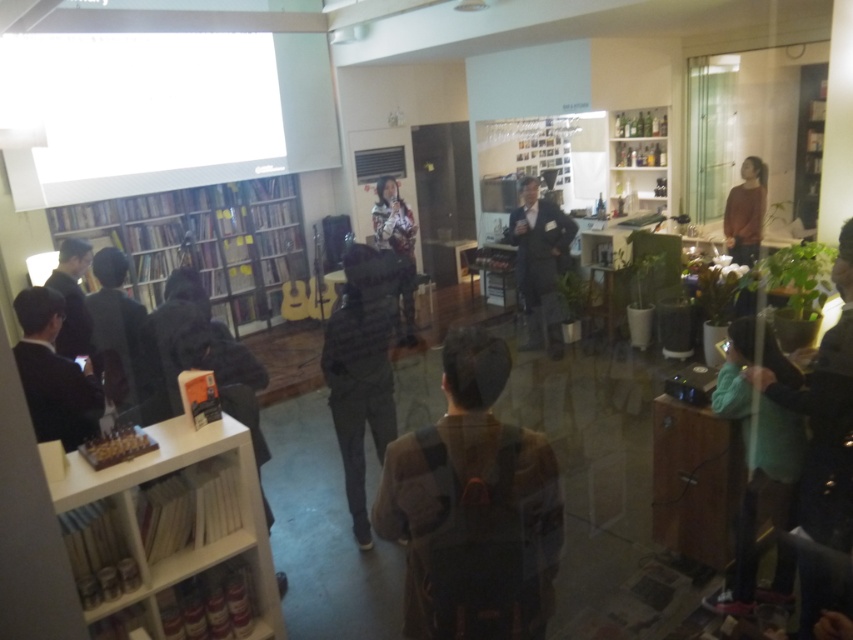
You are a delivery person who needs to place a package between the dark gray jeans at center and the dark gray hoodie at left. The package is 1.5 meters long. Will it fit between them?

The dark gray jeans at center and the dark gray hoodie at left are 1.54 meters apart, so the 1.5 meters long package will fit between them since the distance is slightly larger than the package length.

You are standing at the center of the room and see the dark gray jeans at center. There is a fire alarm on the wall 12 feet away from you. Can you reach the fire alarm by stepping forward from your current position?

The dark gray jeans at center are 11.71 feet apart from you, so stepping forward from your current position would place you approximately 11.71 feet away from the fire alarm, which is 12 feet away. Therefore, you can just barely reach the fire alarm by stepping forward.